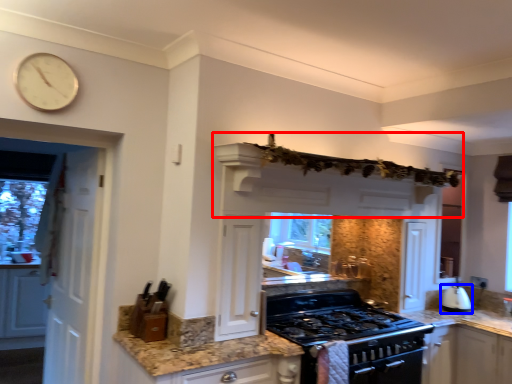
Question: Which of the following is the farthest to the observer, exhaust hood (highlighted by a red box) or kitchen appliance (highlighted by a blue box)?

Choices:
 (A) exhaust hood
 (B) kitchen appliance

Answer: (B)